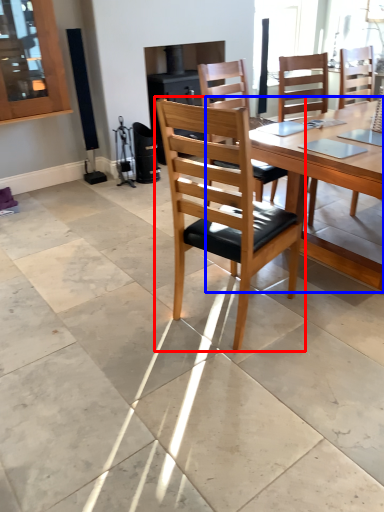
Question: Among these objects, which one is nearest to the camera, chair (highlighted by a red box) or round table (highlighted by a blue box)?

Choices:
 (A) chair
 (B) round table

Answer: (A)